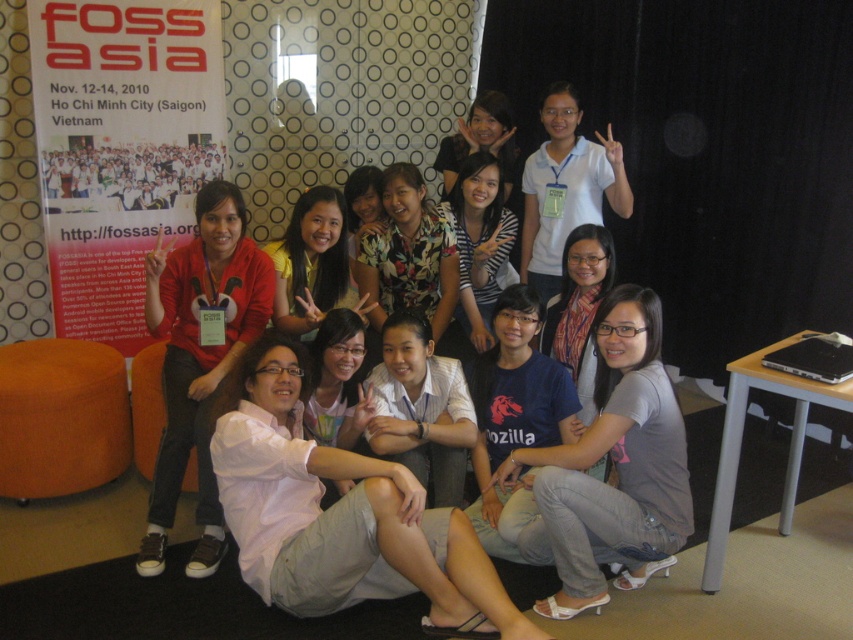
You are standing in front of the FOSSASIA conference photo backdrop and see two points marked as point 1 at coordinates (120, 108) and point 2 at (486, 342). Which point is closer to you?

Point 1 at coordinates (120, 108) is closer to you because it is further to the camera than point 2 at (486, 342).

What is located at the coordinates point (x=120, y=147) in the image?

At point (x=120, y=147) lies white paper poster at left.

You are standing at the point with coordinates point (309, 259) and want to move to the point with coordinates point (189, 173). Which direction should you move in to reach your destination?

You should move backward to reach point (189, 173) because it is behind point (309, 259).